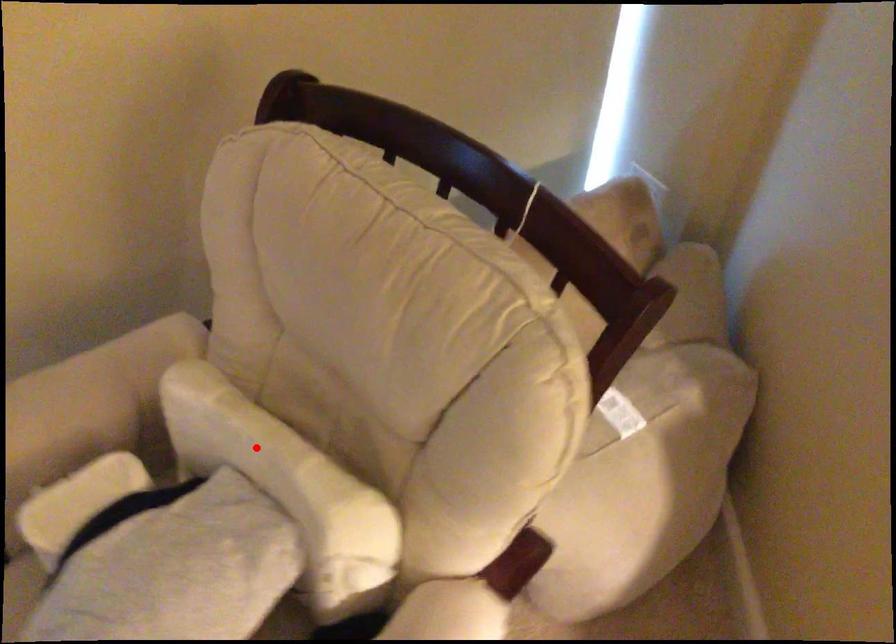
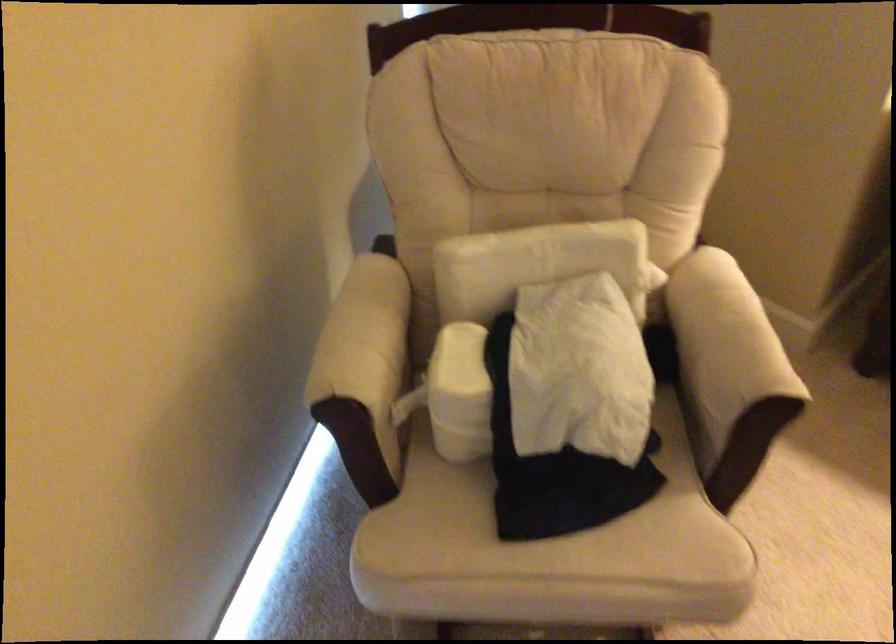
In the second image, find the point that corresponds to the highlighted location in the first image.

(533, 263)